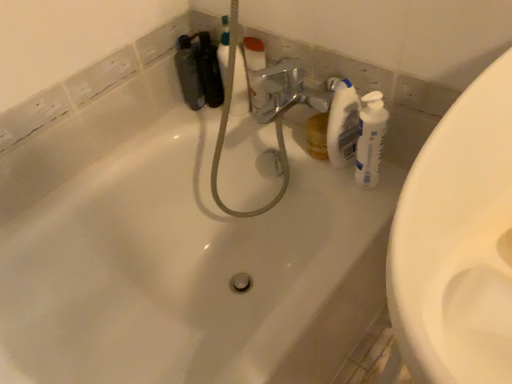
This screenshot has height=384, width=512. I want to click on vacant space in front of translucent plastic bottle at upper right, acting as the first cleaning product starting from the left, so click(358, 206).